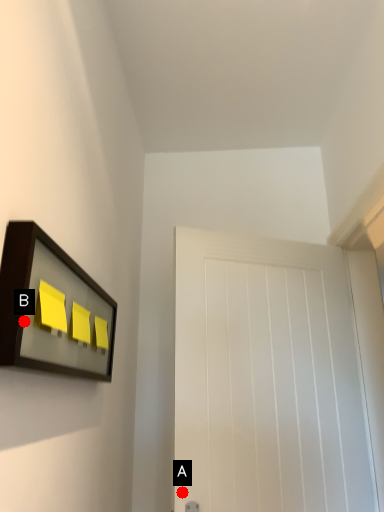
Question: Two points are circled on the image, labeled by A and B beside each circle. Which point is further to the camera?

Choices:
 (A) A is further
 (B) B is further

Answer: (A)